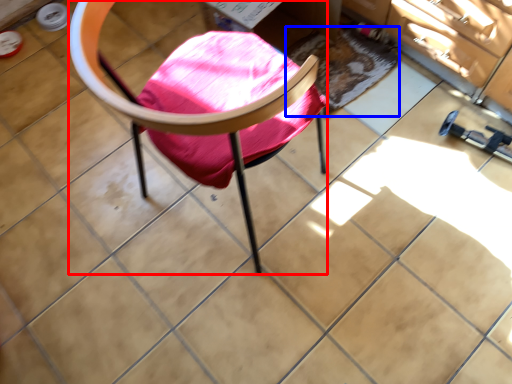
Question: Which object is further to the camera taking this photo, chair (highlighted by a red box) or mat (highlighted by a blue box)?

Choices:
 (A) chair
 (B) mat

Answer: (B)